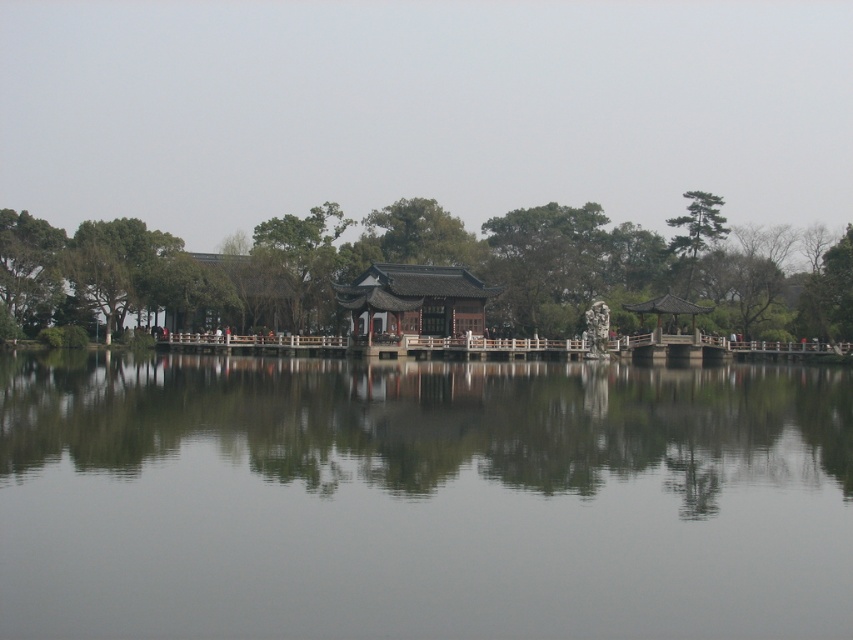
How distant is green leafy tree at left from green matte tree at center?

green leafy tree at left is 76.12 feet from green matte tree at center.

Does point (260, 275) come in front of point (273, 224)?

Yes, point (260, 275) is closer to viewer.

Where is `green leafy tree at left`? The width and height of the screenshot is (853, 640). green leafy tree at left is located at coordinates (434, 275).

Is transparent water at center positioned at the back of green leafy tree at left?

No, it is in front of green leafy tree at left.

Does transparent water at center have a greater width compared to green leafy tree at left?

In fact, transparent water at center might be narrower than green leafy tree at left.

Which is behind, point (515, 442) or point (292, 224)?

The point (292, 224) is behind.

Where is `transparent water at center`? Image resolution: width=853 pixels, height=640 pixels. transparent water at center is located at coordinates click(421, 499).

Which is in front, point (276, 237) or point (700, 212)?

Point (276, 237)

In the scene shown: Does green matte tree at center lie in front of green textured pine tree at upper right?

Yes.

The height and width of the screenshot is (640, 853). What do you see at coordinates (303, 248) in the screenshot?
I see `green matte tree at center` at bounding box center [303, 248].

At what (x,y) coordinates should I click in order to perform the action: click on green matte tree at center. Please return your answer as a coordinate pair (x, y). This screenshot has width=853, height=640. Looking at the image, I should click on (303, 248).